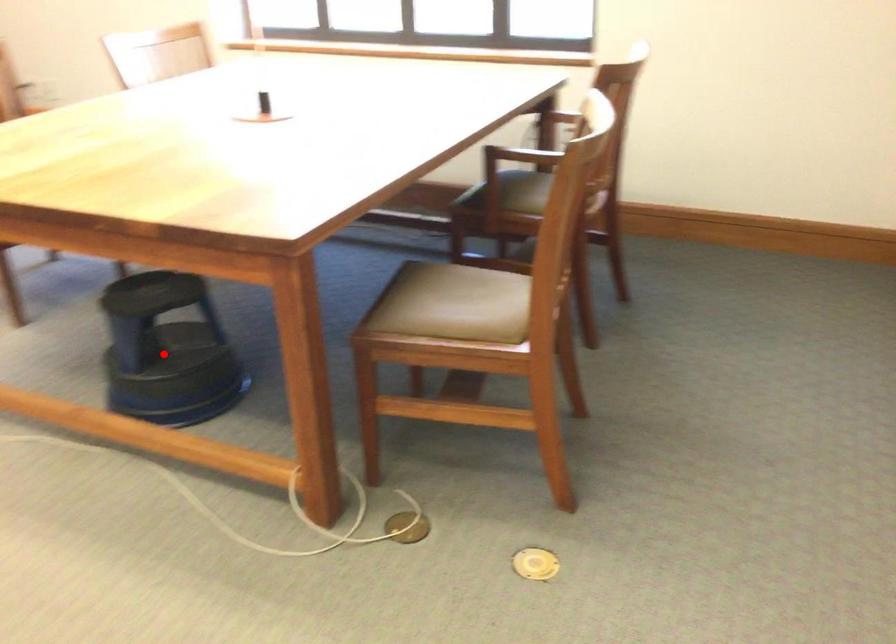
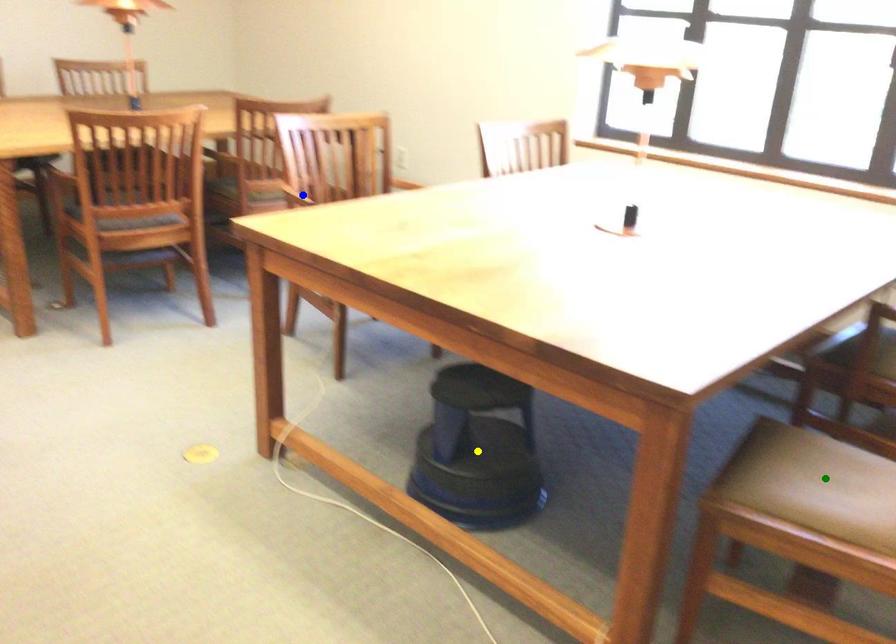
Question: I am providing you with two images of the same scene from different viewpoints. A red point is marked on the first image. You are given multiple points on the second image. Which mark in image 2 goes with the point in image 1?

Choices:
 (A) yellow point
 (B) green point
 (C) blue point

Answer: (A)